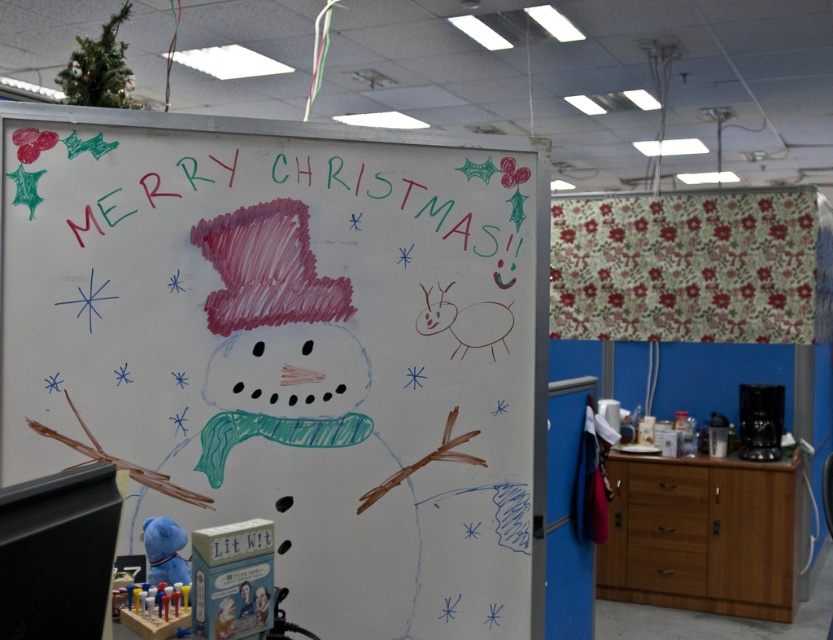
You are standing in front of the festive office cubicle and see the whiteboard at the front. There is a point marked at coordinates [292,348]. What object is located at that point?

The white chalkboard at center is located at point [292,348].

You are organizing a Christmas party in the office and need to place a gift box. The gift box is too heavy to lift. You see the colored chalk snowman at center and the blue plush toy at lower left. Which object is higher up so you can place the gift box there?

The colored chalk snowman at center is located above the blue plush toy at lower left, so you can place the gift box there since it is higher up.

You are organizing a Christmas party and need to place a gift box between the white chalkboard at center and the blue plush toy at lower left. Based on their positions, where should you place the gift box?

The white chalkboard at center is positioned on the right side of blue plush toy at lower left, so you should place the gift box between them, closer to the blue plush toy at lower left since the chalkboard is to its right.